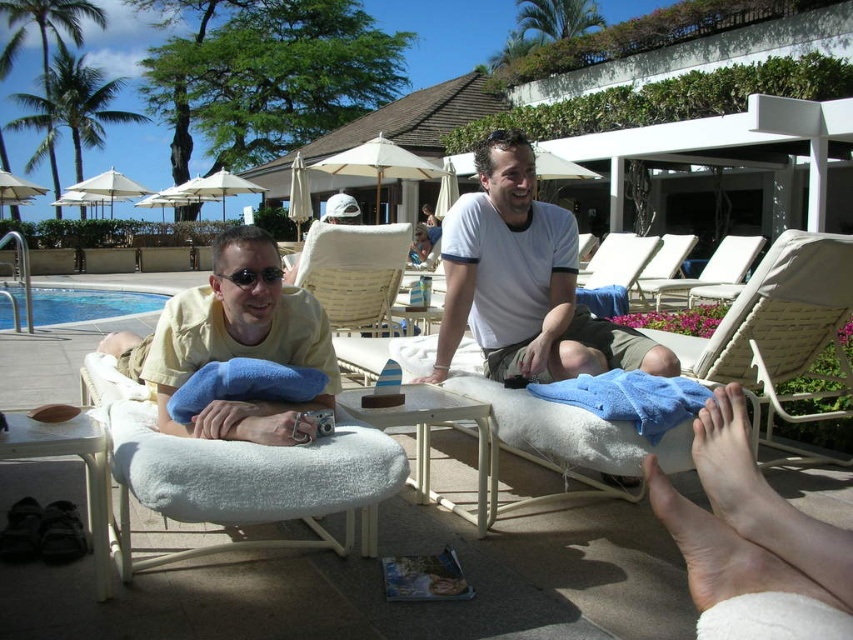
You are standing at the center of the poolside scene. Where is the yellow cotton shirt at left located in relation to your current position?

The yellow cotton shirt at left is located at coordinates point (233, 356) relative to the center of the scene.

You are standing at the point marked as point (543, 236) and want to walk to the pool. The pool is located 10 feet away from you in a straight line. Can you reach the pool without moving more than 10 feet?

The distance between point (543, 236) and the viewer is 9.42 feet, which is less than 10 feet. Therefore, you can reach the pool without moving more than 10 feet.